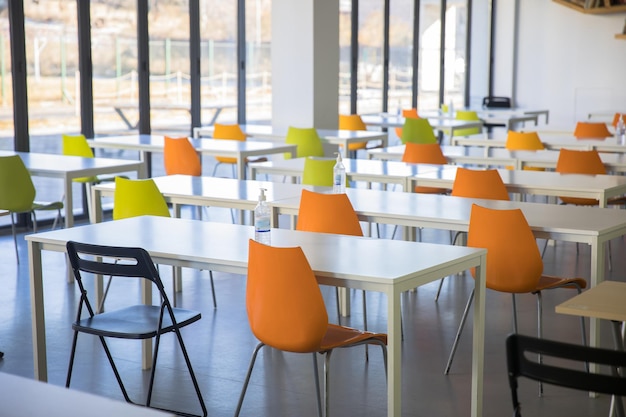
This screenshot has width=626, height=417. In order to click on lime green chairs in this screenshot , I will do `click(13, 187)`, `click(129, 198)`, `click(78, 142)`, `click(303, 140)`, `click(317, 172)`, `click(418, 126)`, `click(467, 116)`, `click(447, 106)`.